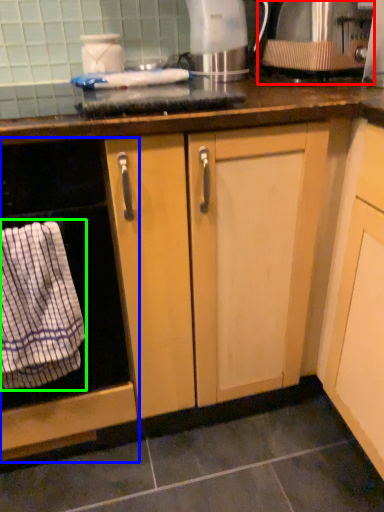
Question: Estimate the real-world distances between objects in this image. Which object is closer to kitchen appliance (highlighted by a red box), home appliance (highlighted by a blue box) or bath towel (highlighted by a green box)?

Choices:
 (A) home appliance
 (B) bath towel

Answer: (A)